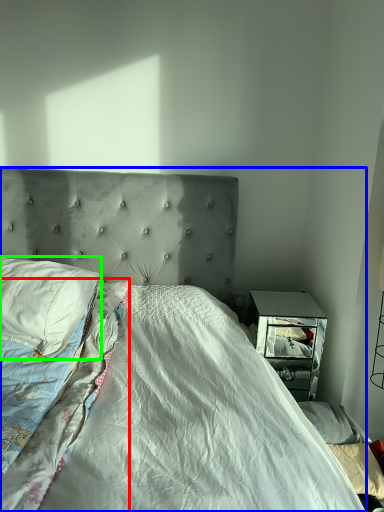
Question: Considering the real-world distances, which object is farthest from blanket (highlighted by a red box)? bed (highlighted by a blue box) or pillow (highlighted by a green box)?

Choices:
 (A) bed
 (B) pillow

Answer: (B)